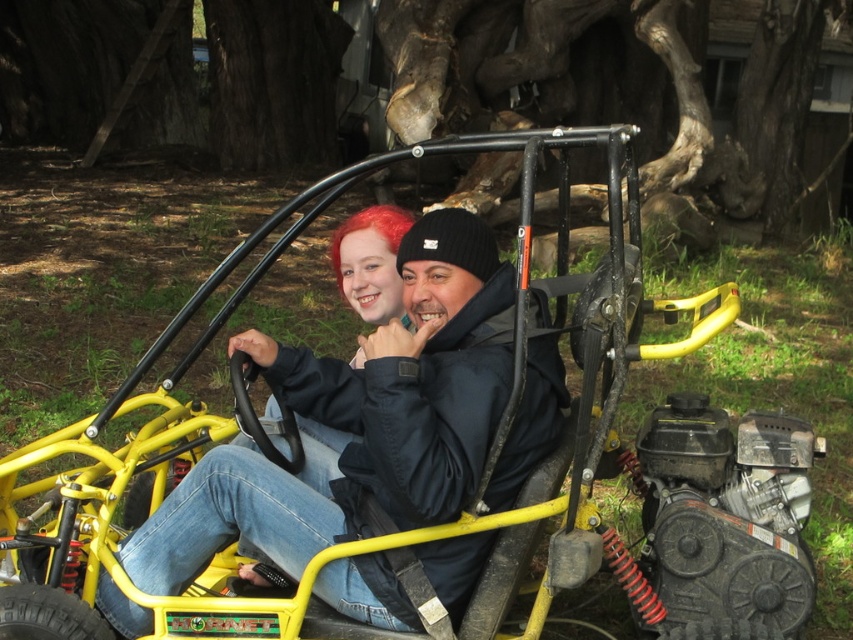
Question: Does matte black jacket at center appear on the right side of vivid red hair at center?

Choices:
 (A) yes
 (B) no

Answer: (A)

Question: Is matte black jacket at center to the right of vivid red hair at center from the viewer's perspective?

Choices:
 (A) yes
 (B) no

Answer: (A)

Question: From the image, what is the correct spatial relationship of matte black jacket at center in relation to vivid red hair at center?

Choices:
 (A) below
 (B) above

Answer: (A)

Question: Which point appears closest to the camera in this image?

Choices:
 (A) (436, 378)
 (B) (392, 243)

Answer: (A)

Question: Which point appears farthest from the camera in this image?

Choices:
 (A) (380, 209)
 (B) (390, 360)

Answer: (A)